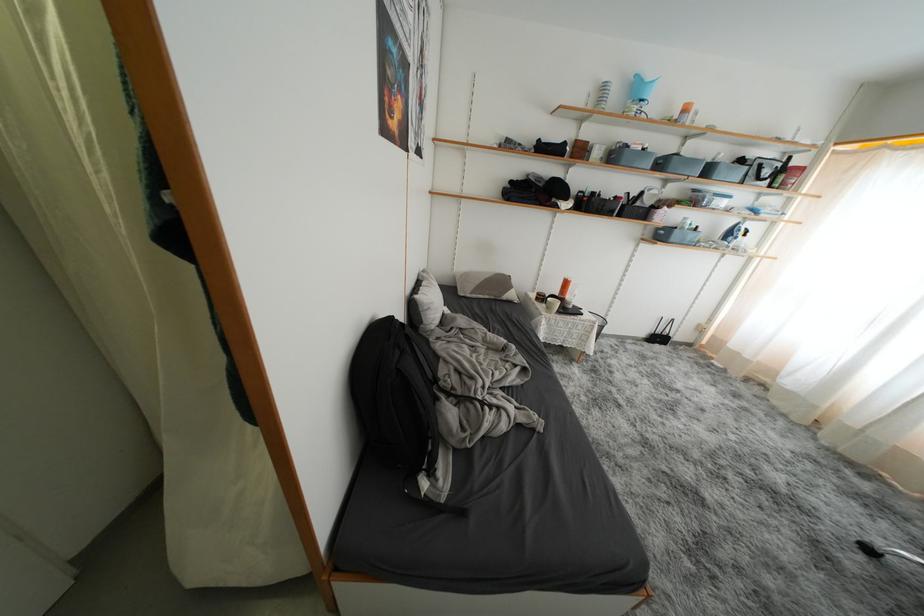
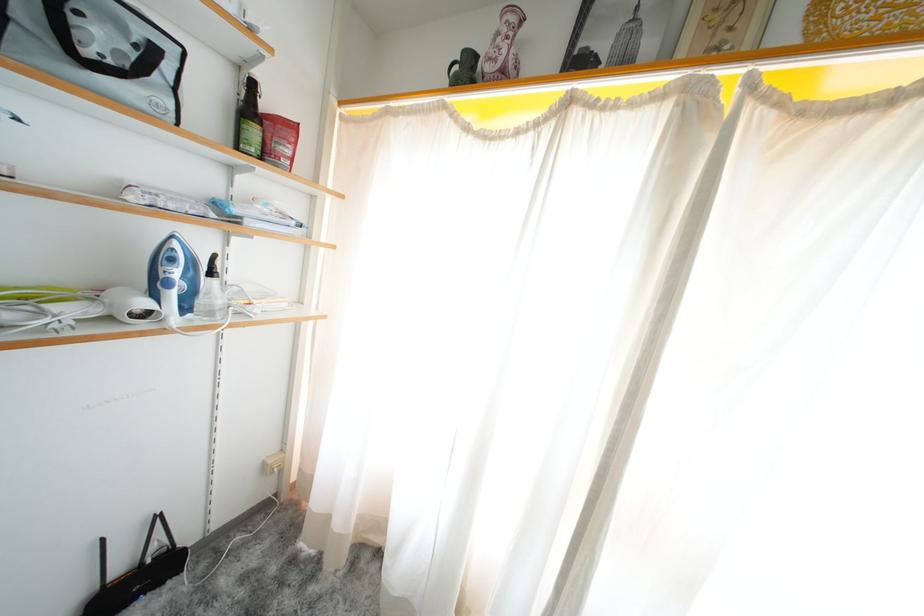
Locate, in the second image, the point that corresponds to point 750,238 in the first image.

(217, 278)